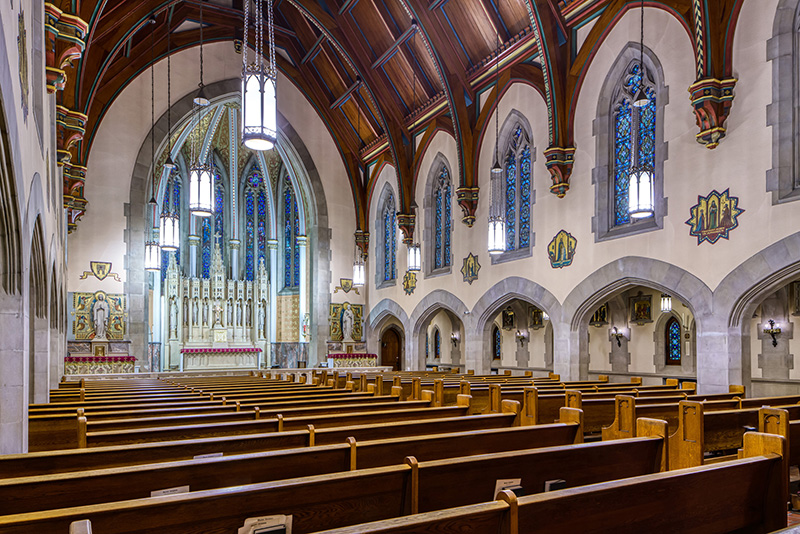
Find the location of a particular element. This screenshot has height=534, width=800. chain lights is located at coordinates (640, 182), (497, 238), (414, 257), (360, 274), (261, 120), (205, 190), (170, 231), (154, 251).